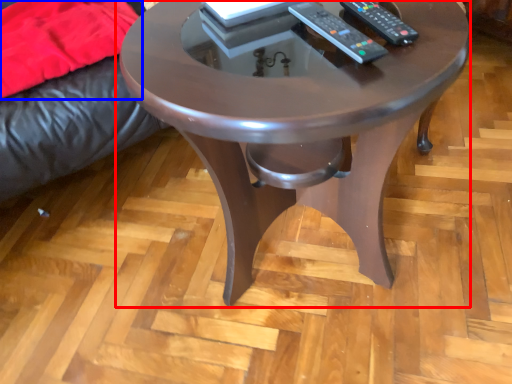
Question: Which point is further to the camera, coffee table (highlighted by a red box) or blanket (highlighted by a blue box)?

Choices:
 (A) coffee table
 (B) blanket

Answer: (B)